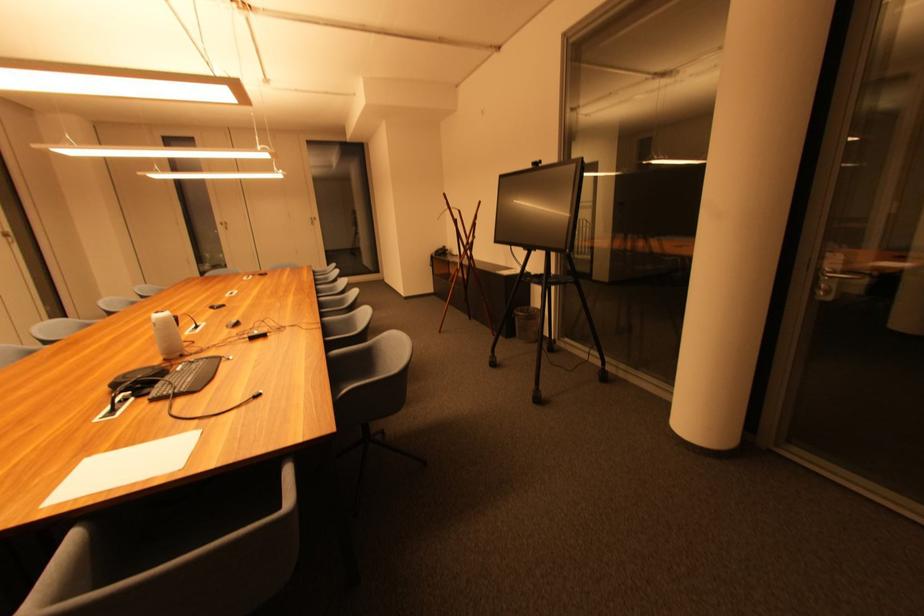
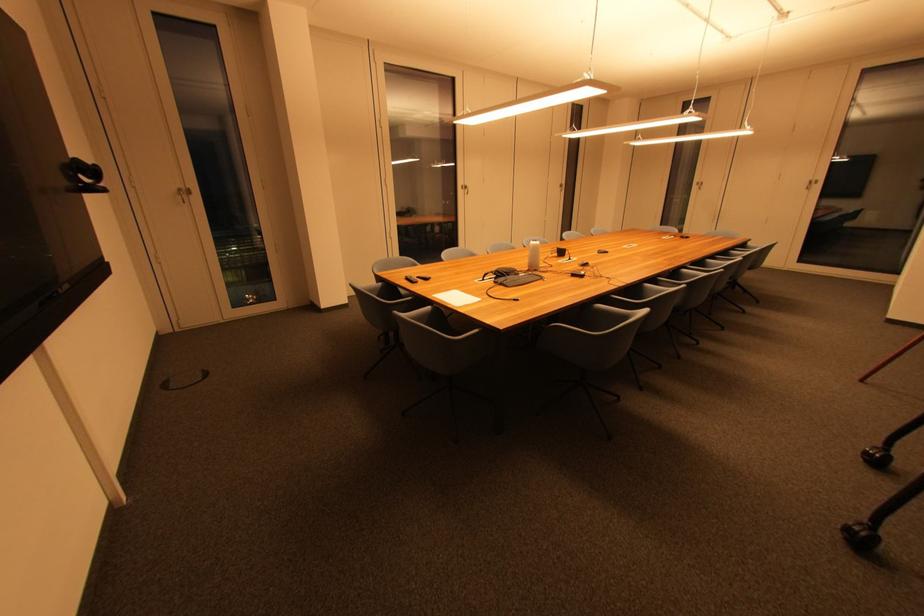
In the second image, find the point that corresponds to (x=80, y=538) in the first image.

(433, 310)